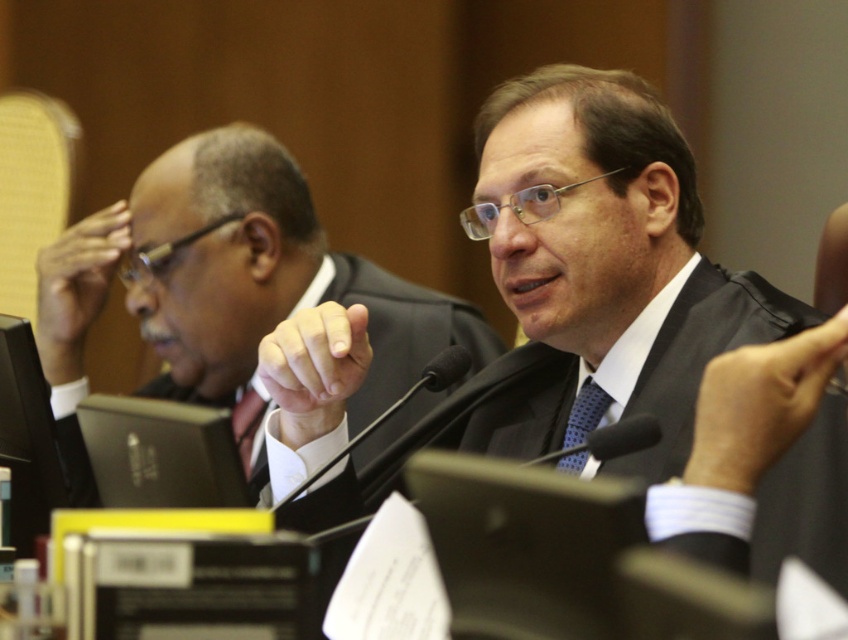
Question: Considering the relative positions of matte black suit at center and matte black suit at left in the image provided, where is matte black suit at center located with respect to matte black suit at left?

Choices:
 (A) above
 (B) below

Answer: (B)

Question: Is matte black suit at left in front of blue dotted tie at center?

Choices:
 (A) no
 (B) yes

Answer: (A)

Question: Which object is positioned closest to the matte black suit at left?

Choices:
 (A) blue dotted tie at center
 (B) matte black tie at center

Answer: (B)

Question: From the image, what is the correct spatial relationship of matte black suit at left in relation to matte black tie at center?

Choices:
 (A) below
 (B) above

Answer: (B)

Question: Which of the following is the closest to the observer?

Choices:
 (A) matte black tie at center
 (B) matte black suit at center

Answer: (B)

Question: Which object is the farthest from the matte black tie at center?

Choices:
 (A) blue dotted tie at center
 (B) matte black suit at center
 (C) matte black suit at left

Answer: (B)